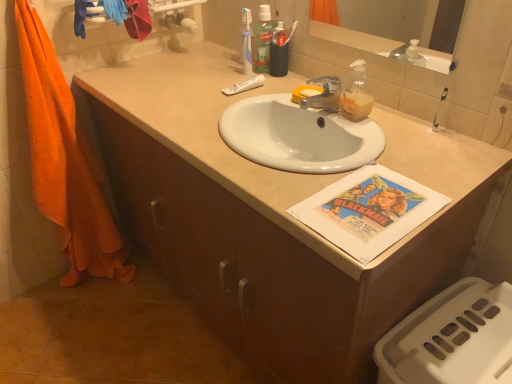
The height and width of the screenshot is (384, 512). Find the location of `free space underneath orange cotton towel at left (from a real-world perspective)`. free space underneath orange cotton towel at left (from a real-world perspective) is located at coordinates (95, 283).